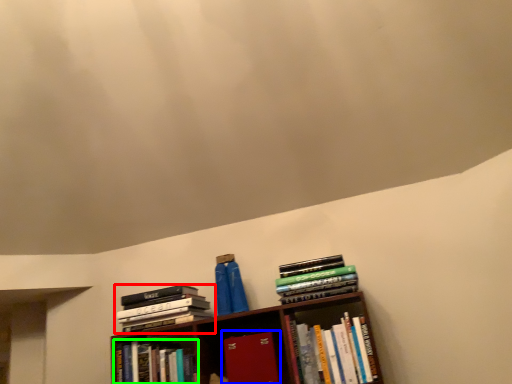
Question: Which is farther away from book (highlighted by a red box)? book (highlighted by a blue box) or book (highlighted by a green box)?

Choices:
 (A) book
 (B) book

Answer: (A)